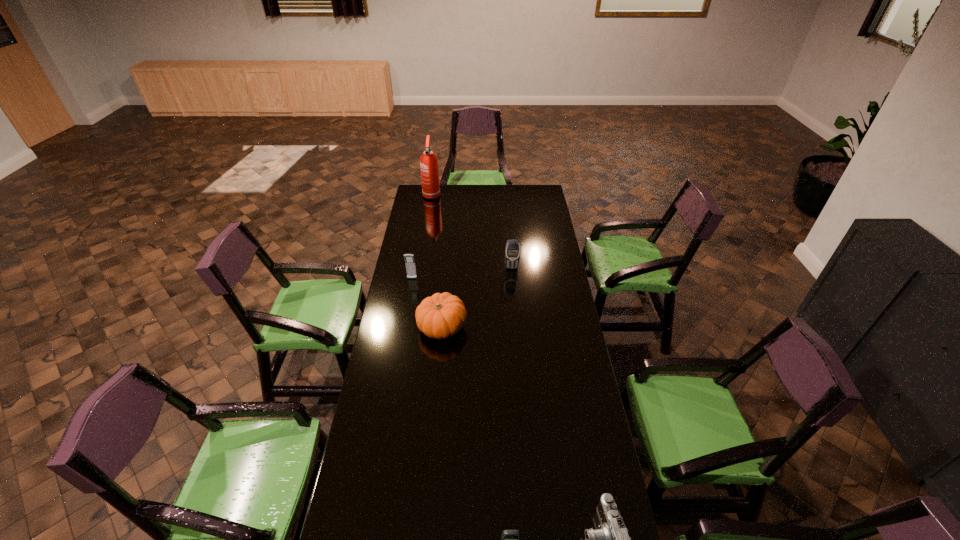
Where is `free spot located 0.100m on the right of the pumpkin`? This screenshot has height=540, width=960. free spot located 0.100m on the right of the pumpkin is located at coordinates (490, 327).

The image size is (960, 540). I want to click on object located at the far edge, so click(x=428, y=161).

Where is `fire extinguisher present at the left edge`? The image size is (960, 540). fire extinguisher present at the left edge is located at coordinates (428, 161).

The image size is (960, 540). I want to click on cellular telephone that is positioned at the left edge, so click(x=409, y=258).

I want to click on pumpkin located at the left edge, so click(440, 316).

Where is `object that is positioned at the far left corner`? Image resolution: width=960 pixels, height=540 pixels. object that is positioned at the far left corner is located at coordinates (428, 161).

In order to click on vacant region at the far edge in this screenshot , I will do `click(516, 204)`.

Identify the location of free point at the left edge. [x=417, y=260].

What are the coordinates of `vacant space at the right edge of the desktop` in the screenshot? It's located at (565, 479).

This screenshot has width=960, height=540. Find the location of `vacant space at the far left corner of the desktop`. vacant space at the far left corner of the desktop is located at coordinates (431, 204).